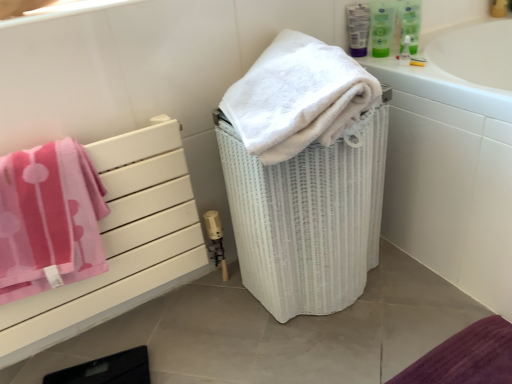
The width and height of the screenshot is (512, 384). Find the location of `vacant space in front of translucent plastic mouthwash at upper right, acting as the third mouthwash starting from the right`. vacant space in front of translucent plastic mouthwash at upper right, acting as the third mouthwash starting from the right is located at coordinates (391, 61).